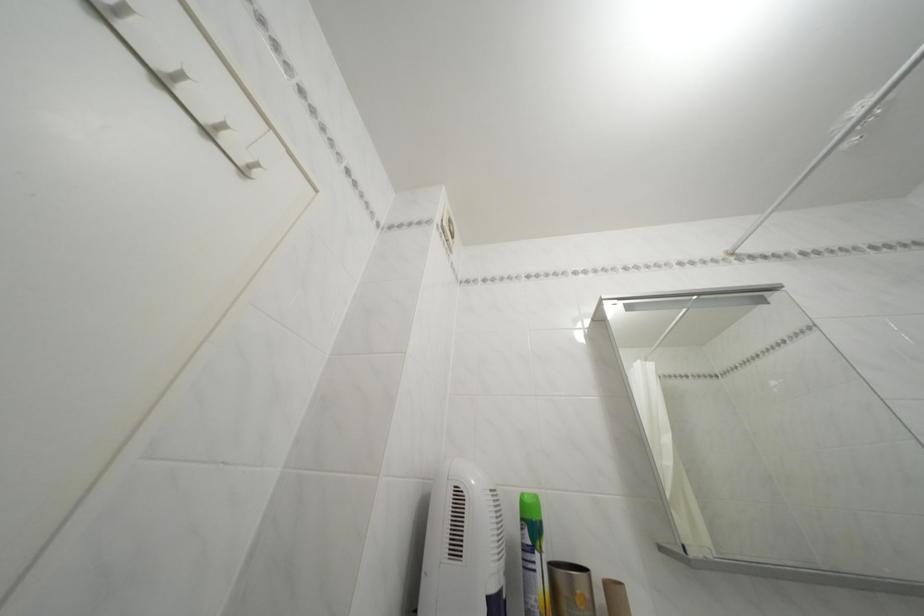
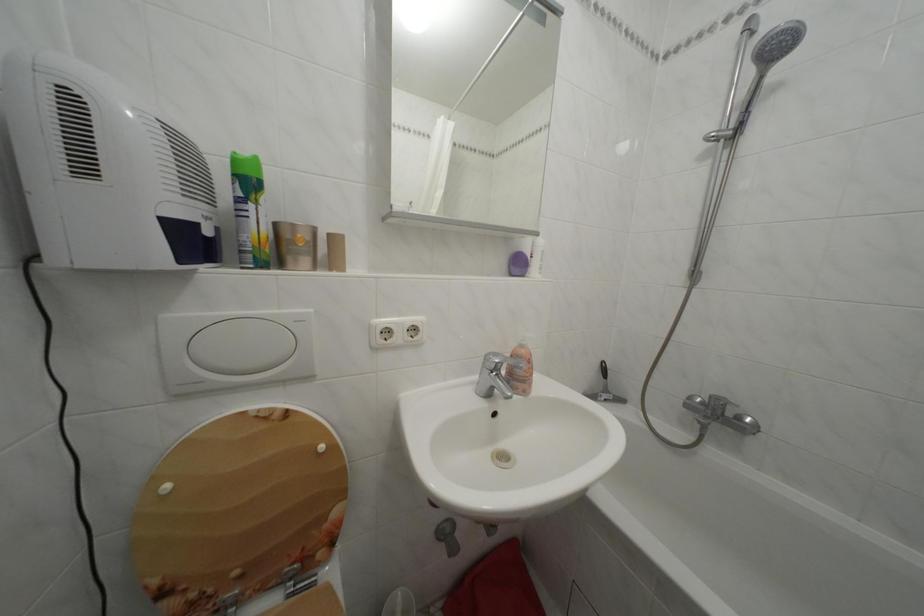
First-person continuous shooting, in which direction is the camera rotating?

The camera rotated toward right-down.